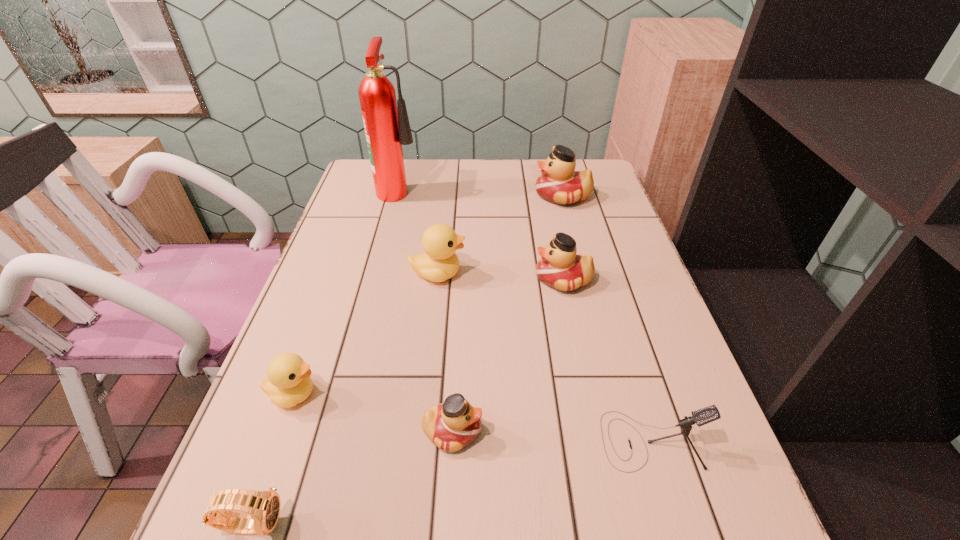
Select which object appears as the fifth closest to the bigger yellow duck. Please provide its 2D coordinates. Your answer should be formatted as a tuple, i.e. [(x, y)], where the tuple contains the x and y coordinates of a point satisfying the conditions above.

[(454, 424)]

Where is `object that stands as the closest to the farthest duck`? The height and width of the screenshot is (540, 960). object that stands as the closest to the farthest duck is located at coordinates (560, 268).

You are a GUI agent. You are given a task and a screenshot of the screen. Output one action in this format:
    pyautogui.click(x=<x>, y=<y>)
    Task: Click on the duck that is the fourth closest to the microphone
    This screenshot has width=960, height=540.
    Given the screenshot: What is the action you would take?
    pyautogui.click(x=289, y=383)

At what (x,y) coordinates should I click in order to perform the action: click on duck that is the third closest to the leftmost duck. Please return your answer as a coordinate pair (x, y). The image size is (960, 540). Looking at the image, I should click on (560, 268).

Identify which red duck is located as the nearest to the second farthest red duck. Please provide its 2D coordinates. Your answer should be formatted as a tuple, i.e. [(x, y)], where the tuple contains the x and y coordinates of a point satisfying the conditions above.

[(559, 183)]

Locate an element on the screen. The image size is (960, 540). red duck that is the second closest to the nearer yellow duck is located at coordinates (560, 268).